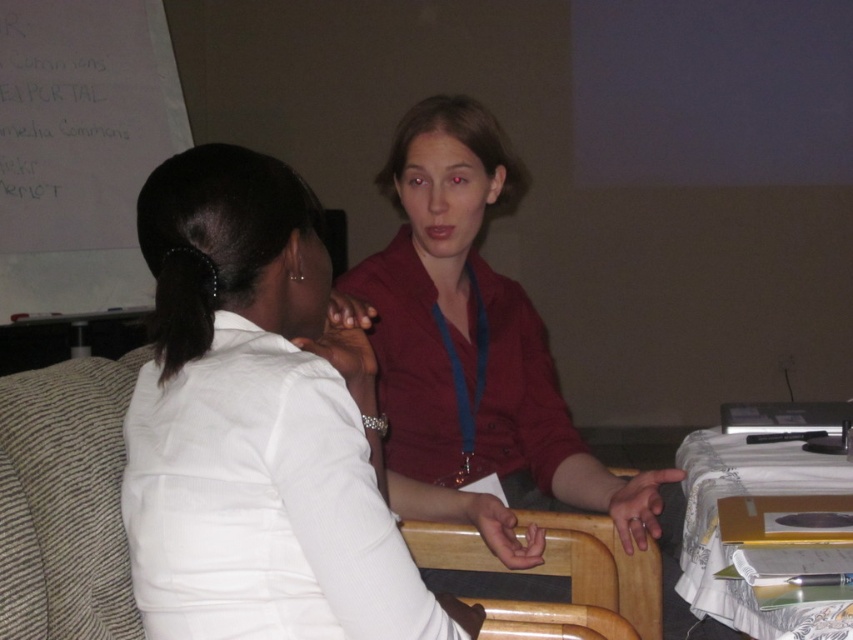
Question: Does matte red blouse at upper center have a lesser width compared to white cloth-covered table at lower right?

Choices:
 (A) no
 (B) yes

Answer: (A)

Question: Which object is the closest to the matte red blouse at upper center?

Choices:
 (A) white paper at upper left
 (B) matte red shirt at center
 (C) white cloth-covered table at lower right

Answer: (B)

Question: Which object is positioned farthest from the matte red shirt at center?

Choices:
 (A) white cloth-covered table at lower right
 (B) white paper at upper left

Answer: (B)

Question: Can you confirm if matte red shirt at center is smaller than white paper at upper left?

Choices:
 (A) no
 (B) yes

Answer: (A)

Question: Which object is farther from the camera taking this photo?

Choices:
 (A) white paper at upper left
 (B) white cloth-covered table at lower right
 (C) beech wood chair at center
 (D) matte red shirt at center

Answer: (A)

Question: Can you confirm if matte red blouse at upper center is thinner than beech wood chair at center?

Choices:
 (A) no
 (B) yes

Answer: (B)